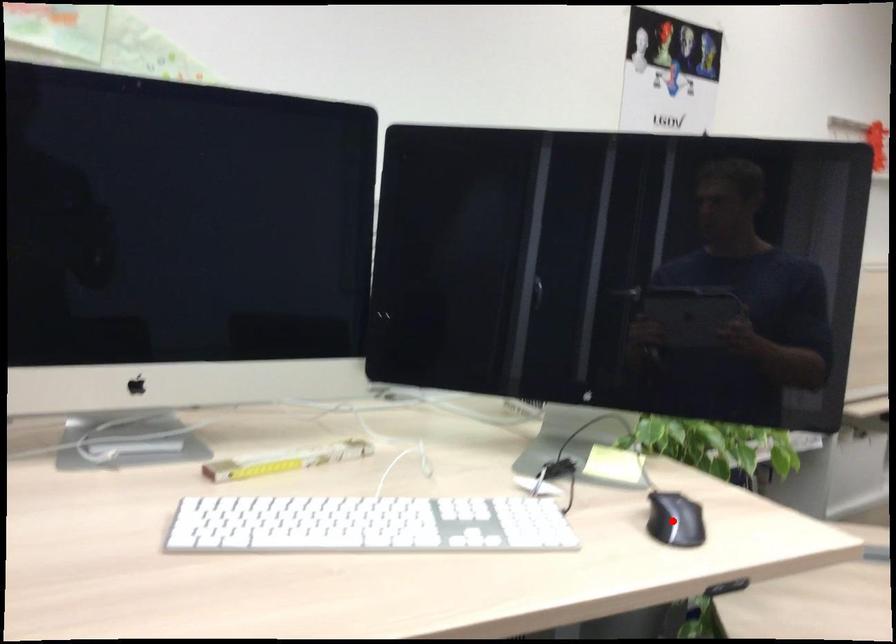
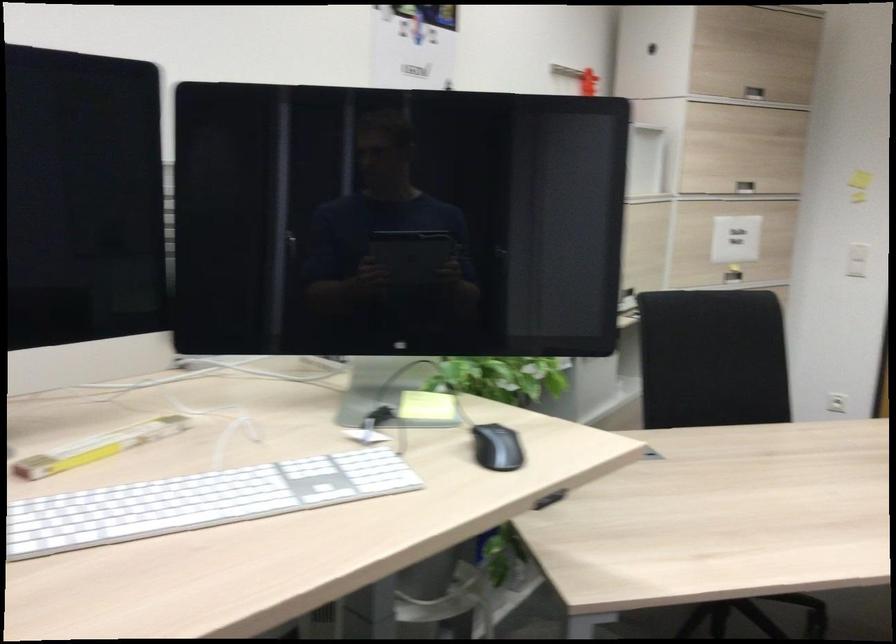
Question: I am providing you with two images of the same scene from different viewpoints. A red point is shown in image1. For the corresponding object point in image2, is it positioned nearer or farther from the camera?

Choices:
 (A) Nearer
 (B) Farther

Answer: (B)